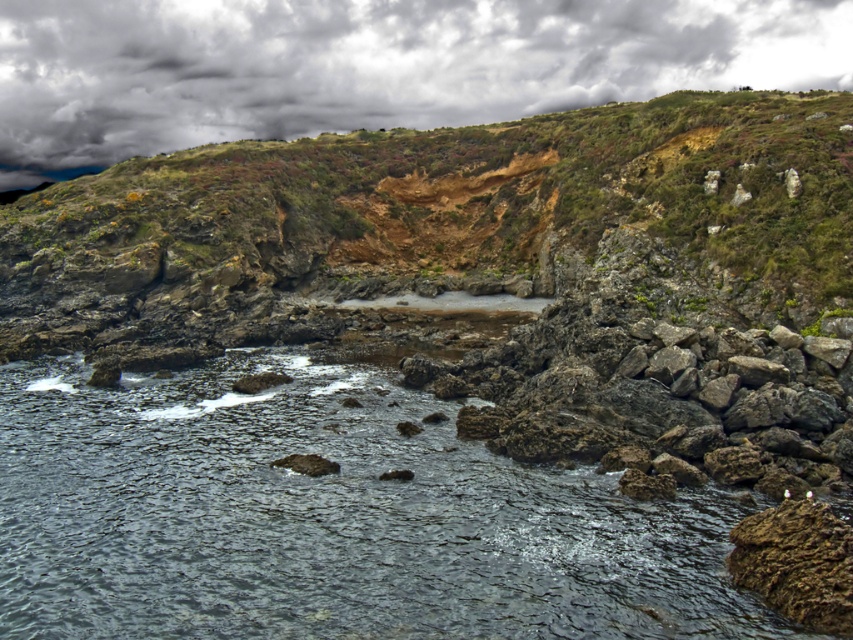
Is the position of cloudy gray sky at upper center more distant than that of rough stone cliff at center?

Yes, cloudy gray sky at upper center is further from the viewer.

Who is more forward, (672, 16) or (521, 364)?

Point (521, 364) is more forward.

You are a GUI agent. You are given a task and a screenshot of the screen. Output one action in this format:
    pyautogui.click(x=<x>, y=<y>)
    Task: Click on the cloudy gray sky at upper center
    The image size is (853, 640).
    Given the screenshot: What is the action you would take?
    pyautogui.click(x=370, y=67)

Can you confirm if dark gray water at center is shorter than rugged rock cliff at center?

Indeed, dark gray water at center has a lesser height compared to rugged rock cliff at center.

From the picture: Between dark gray water at center and rugged rock cliff at center, which one is positioned lower?

dark gray water at center

Does point (155, 604) come closer to viewer compared to point (666, 189)?

Yes, it is in front of point (666, 189).

Find the location of `dark gray water at center`. dark gray water at center is located at coordinates (329, 518).

Which of these two, dark gray water at center or rough stone cliff at center, stands taller?

rough stone cliff at center is taller.

Is dark gray water at center further to camera compared to rough stone cliff at center?

No, dark gray water at center is closer to the viewer.

Identify the location of dark gray water at center. The width and height of the screenshot is (853, 640). pos(329,518).